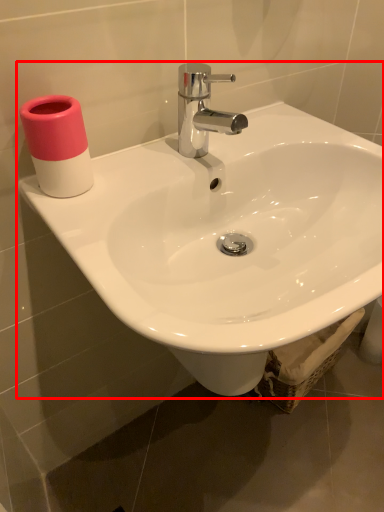
Question: Considering the relative positions of sink (annotated by the red box) and toiletry in the image provided, where is sink (annotated by the red box) located with respect to the staircase?

Choices:
 (A) right
 (B) left

Answer: (A)